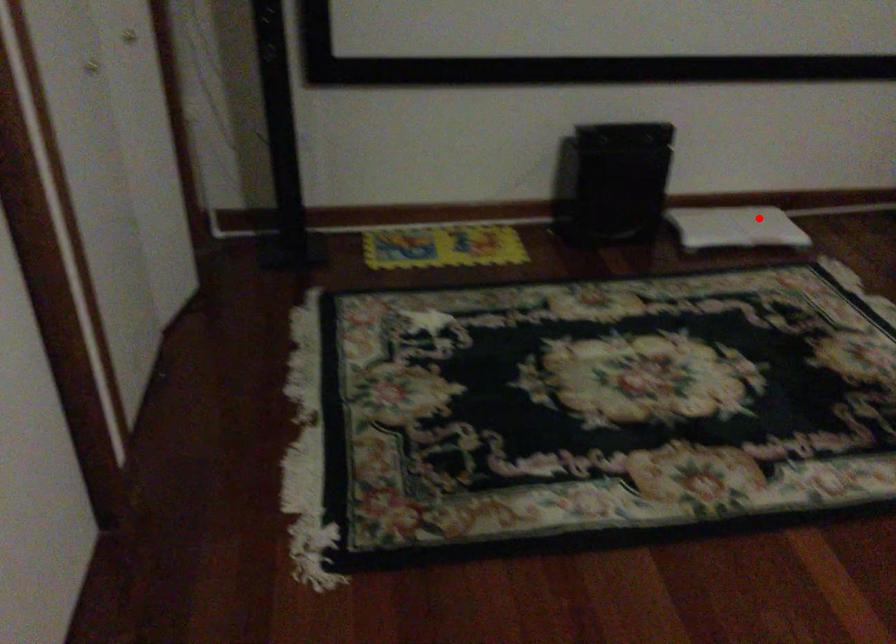
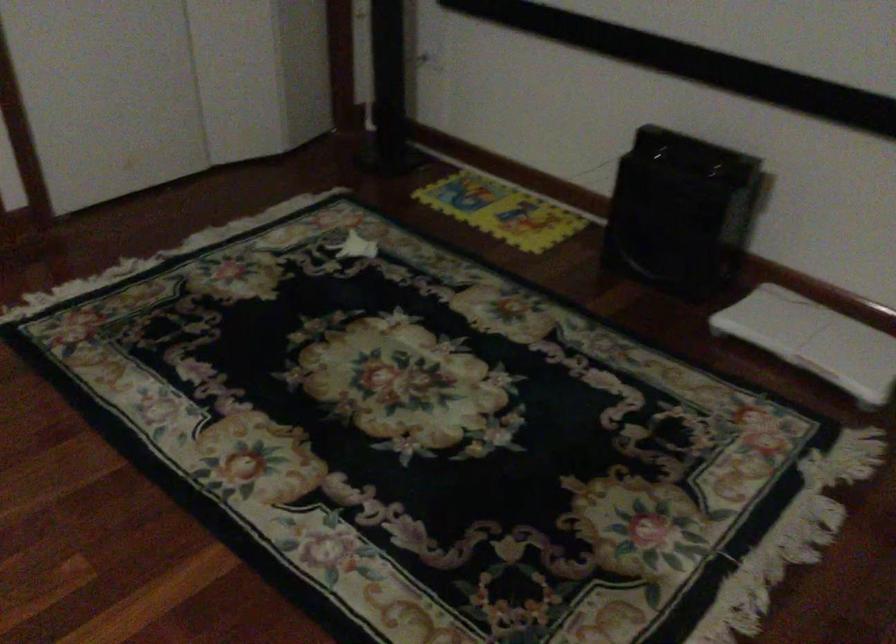
Question: I am providing you with two images of the same scene from different viewpoints. Image1 has a red point marked. In image2, the corresponding 3D location appears at what relative position? Reply with the corresponding letter.

Choices:
 (A) Closer
 (B) Farther

Answer: (A)